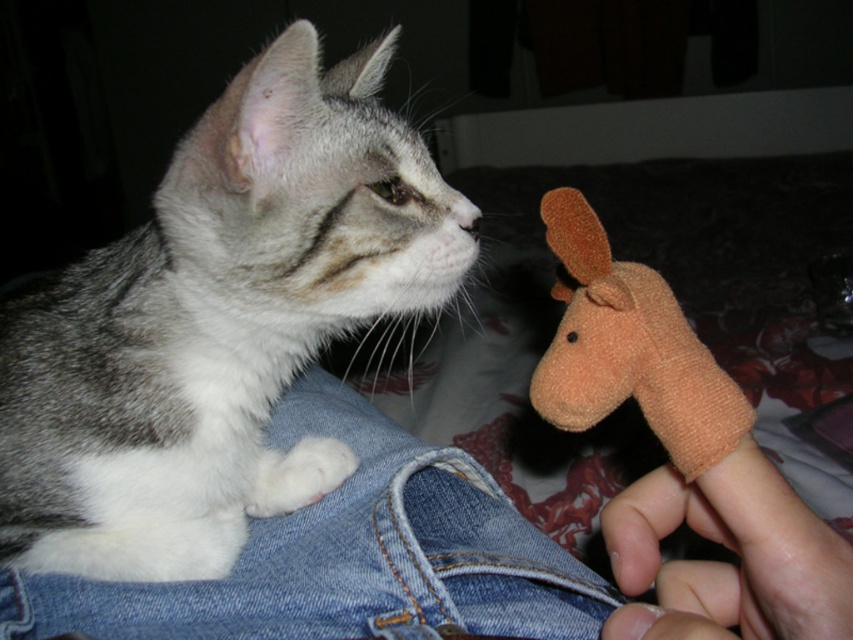
You are a cat owner trying to decide where to place a small treat. You see the denim at left and the denim pocket at lower left. Which location is closer to the cat?

The denim at left is positioned over the denim pocket at lower left, so the denim at left is closer to the cat.

You are a cat owner trying to decide where to place a new toy. Based on the scene, which object is positioned higher up, the denim at left or the orange fabric finger puppet at lower right?

The orange fabric finger puppet at lower right is higher up than the denim at left because the denim at left is below the orange fabric finger puppet at lower right.

You are a cat owner trying to decide whether to place the orange fuzzy finger puppet at right into the denim pocket at lower left. Based on their sizes, will the puppet fit inside the pocket?

The orange fuzzy finger puppet at right has a lesser width compared to the denim pocket at lower left, so it should fit inside the pocket.